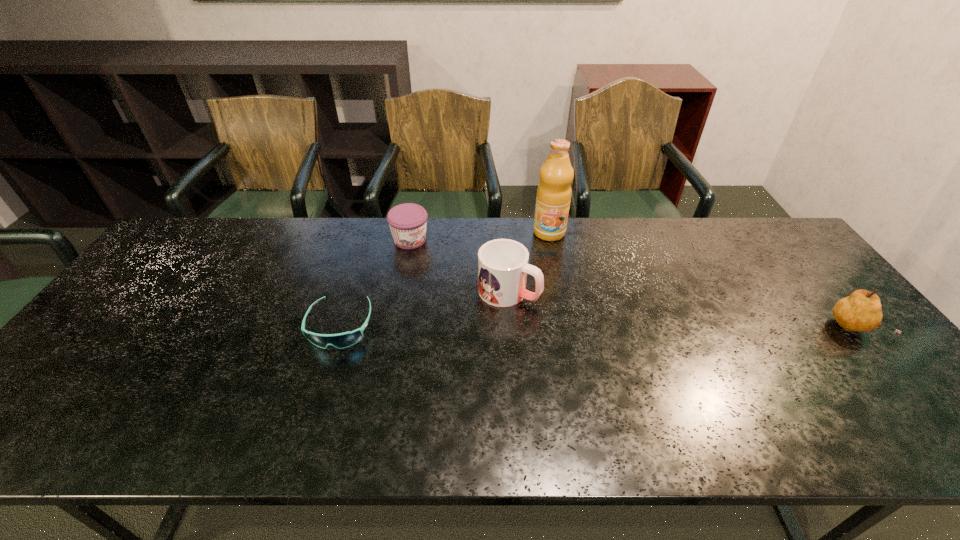
In the image, there is a desktop. Where is `blank space at the far edge`? blank space at the far edge is located at coordinates (438, 232).

Find the location of a particular element. This screenshot has width=960, height=540. vacant region at the near edge of the desktop is located at coordinates (156, 385).

In the image, there is a desktop. What are the coordinates of `free space at the right edge` in the screenshot? It's located at (813, 274).

This screenshot has height=540, width=960. I want to click on free point at the far right corner, so click(x=763, y=230).

You are a GUI agent. You are given a task and a screenshot of the screen. Output one action in this format:
    pyautogui.click(x=<x>, y=<y>)
    Task: Click on the empty location between the fourth object from left to right and the mug
    Image resolution: width=960 pixels, height=540 pixels.
    Given the screenshot: What is the action you would take?
    pyautogui.click(x=529, y=262)

The height and width of the screenshot is (540, 960). I want to click on free point between the second object from right to left and the sunglasses, so click(444, 279).

Identify the location of free point between the fourth tallest object and the sunglasses. (375, 283).

Find the location of `vacant point located between the mug and the pear`. vacant point located between the mug and the pear is located at coordinates (681, 310).

This screenshot has height=540, width=960. Find the location of `unoccupied position between the rightmost object and the jam`. unoccupied position between the rightmost object and the jam is located at coordinates (632, 285).

Identify the location of unoccupied position between the jam and the third object from right to left. (460, 266).